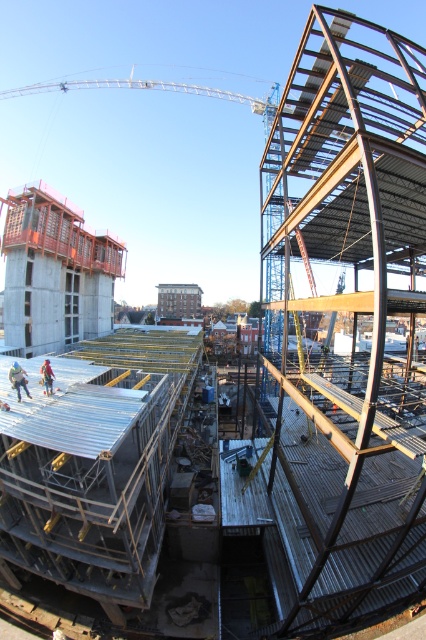
Is blue jeans construction worker at lower left above orange safety vest at center?

Incorrect, blue jeans construction worker at lower left is not positioned above orange safety vest at center.

What do you see at coordinates (17, 378) in the screenshot? The width and height of the screenshot is (426, 640). I see `blue jeans construction worker at lower left` at bounding box center [17, 378].

Which is behind, point (11, 372) or point (51, 388)?

The point (51, 388) is behind.

Find the location of a particular element. The height and width of the screenshot is (640, 426). blue jeans construction worker at lower left is located at coordinates (x=17, y=378).